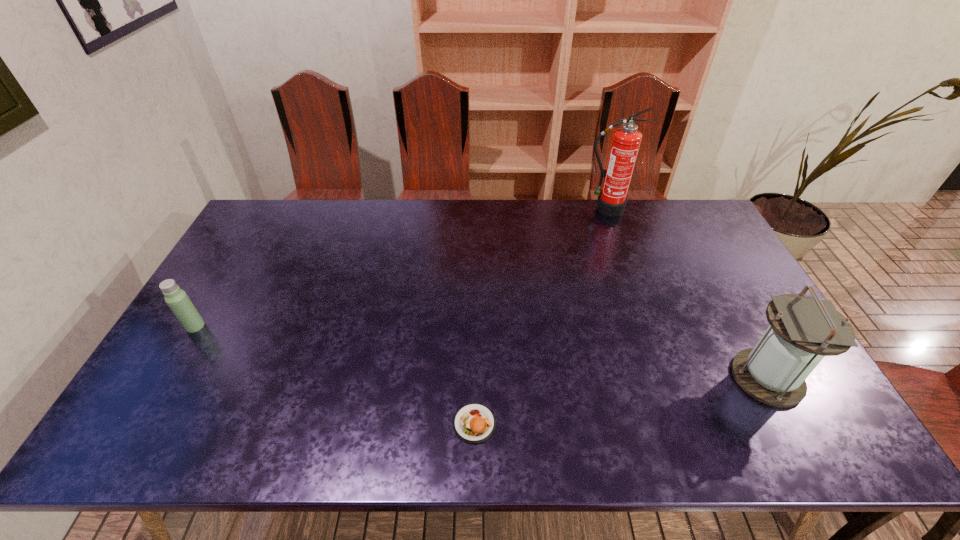
This screenshot has width=960, height=540. I want to click on vacant position at the far right corner of the desktop, so click(x=682, y=201).

You are a GUI agent. You are given a task and a screenshot of the screen. Output one action in this format:
    pyautogui.click(x=<x>, y=<y>)
    Task: Click on the free space at the near right corner
    The height and width of the screenshot is (540, 960).
    Given the screenshot: What is the action you would take?
    pyautogui.click(x=811, y=452)

In order to click on vacant space that's between the second farthest object and the rightmost object in this screenshot , I will do `click(481, 352)`.

This screenshot has height=540, width=960. I want to click on empty space between the rightmost object and the second shortest object, so click(x=481, y=352).

Identify the location of free space between the third shortest object and the thermos bottle. click(x=481, y=352).

Image resolution: width=960 pixels, height=540 pixels. Find the location of `free space between the second object from right to left and the thermos bottle`. free space between the second object from right to left and the thermos bottle is located at coordinates (400, 267).

Find the location of a particular element. vacant space that's between the leftmost object and the patty (food) is located at coordinates (335, 375).

Locate an element on the screen. This screenshot has width=960, height=540. vacant area that lies between the thermos bottle and the shortest object is located at coordinates (335, 375).

Where is `free area in between the third shortest object and the shortest object`? free area in between the third shortest object and the shortest object is located at coordinates (621, 401).

The height and width of the screenshot is (540, 960). I want to click on free space between the third shortest object and the third nearest object, so click(x=481, y=352).